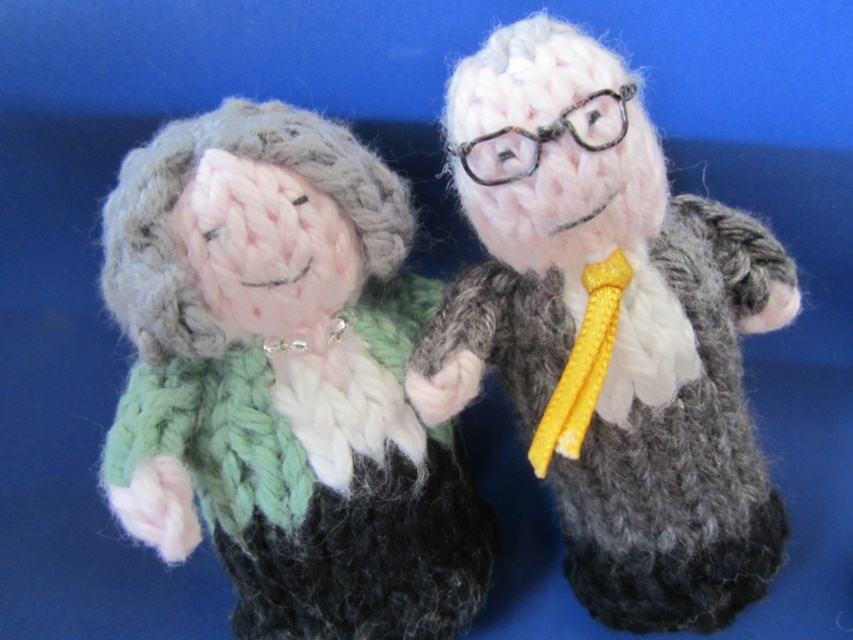
Between knitted woolen doll at center and knitted woolen suit at center, which one is positioned higher?

knitted woolen suit at center is above.

Is point (253, 506) more distant than point (659, 458)?

No, (253, 506) is in front of (659, 458).

This screenshot has width=853, height=640. In order to click on knitted woolen doll at center in this screenshot , I will do `click(283, 380)`.